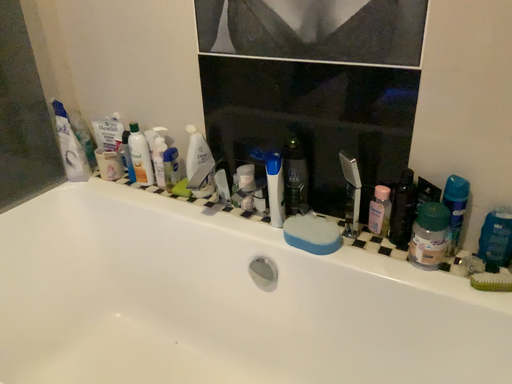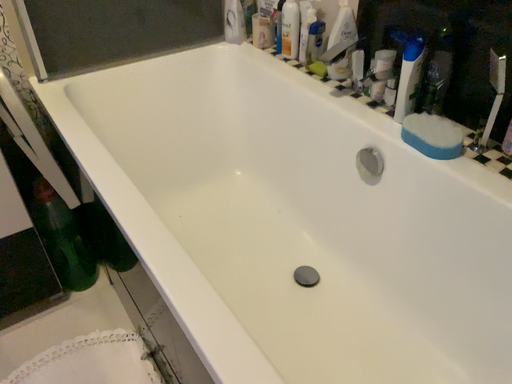
Question: How did the camera likely rotate when shooting the video?

Choices:
 (A) rotated downward
 (B) rotated upward

Answer: (A)